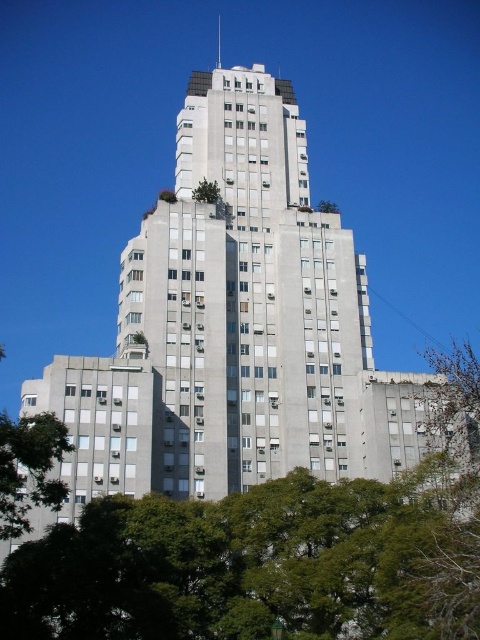
You are standing in front of the building and want to take a photo. There are two points marked on the building facade at coordinates point (204, 195) and point (337, 209). Which point will appear larger in your photo?

Point (204, 195) is closer to the camera than point (337, 209), so it will appear larger in the photo.

You are a landscape architect planning to plant a new tree between the green leafy tree at lower center and the green leafy tree at lower left. Based on their current widths, which tree would require more space to avoid overcrowding?

The green leafy tree at lower center might require more space than the green leafy tree at lower left because it might be wider, so planting between them should consider the width of the tree at lower center to avoid overcrowding.

You are standing at the point marked as point (x=272, y=554) in the image. Looking around, you see a green leafy tree at lower center. Can you tell me what is located at that specific point?

The point (x=272, y=554) is where the green leafy tree at lower center is located.